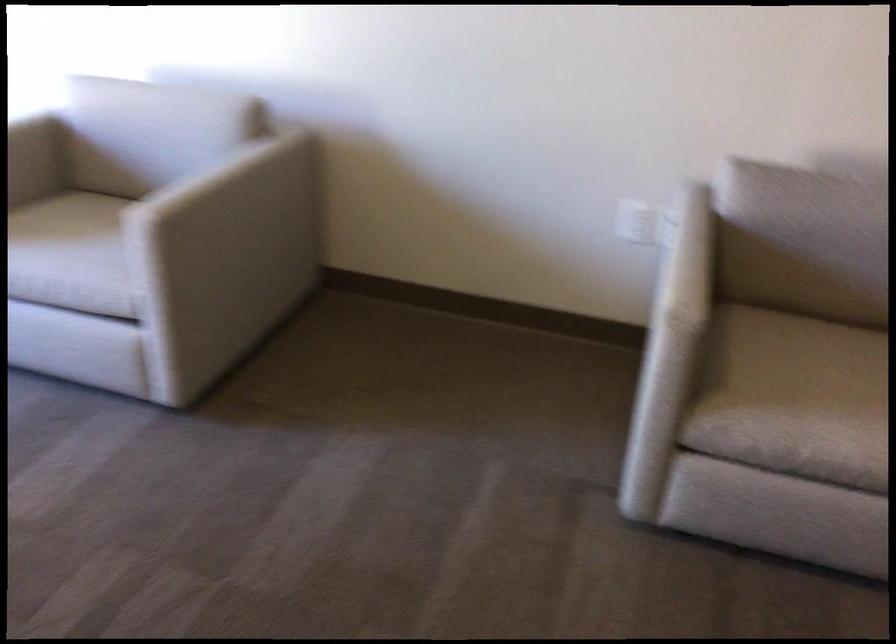
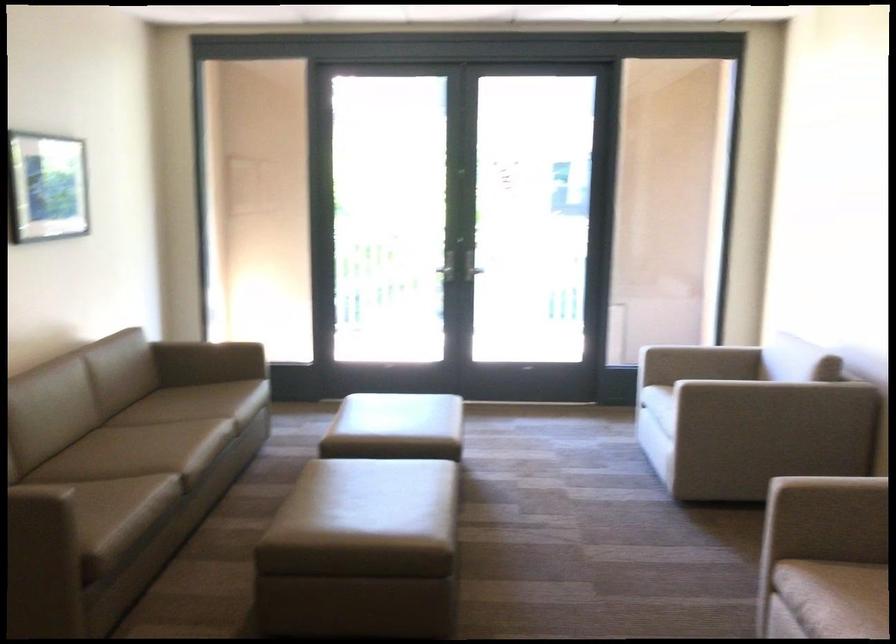
Locate, in the second image, the point that corresponds to [761,386] in the first image.

(856, 591)